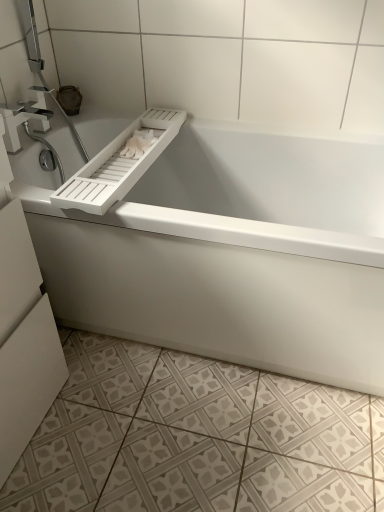
Question: Should I look upward or downward to see white matte toilet paper at upper center?

Choices:
 (A) down
 (B) up

Answer: (B)

Question: Is satin nickel faucet at upper left closer to camera compared to white matte bathtub at center?

Choices:
 (A) no
 (B) yes

Answer: (A)

Question: From a real-world perspective, is satin nickel faucet at upper left positioned under white matte bathtub at center based on gravity?

Choices:
 (A) yes
 (B) no

Answer: (B)

Question: Is satin nickel faucet at upper left with white matte bathtub at center?

Choices:
 (A) no
 (B) yes

Answer: (A)

Question: Is satin nickel faucet at upper left oriented away from white matte bathtub at center?

Choices:
 (A) yes
 (B) no

Answer: (B)

Question: Does satin nickel faucet at upper left have a larger size compared to white matte bathtub at center?

Choices:
 (A) yes
 (B) no

Answer: (B)

Question: From a real-world perspective, does satin nickel faucet at upper left stand above white matte bathtub at center?

Choices:
 (A) no
 (B) yes

Answer: (B)

Question: Considering the relative positions of white matte toilet paper at upper center and white textured tile at lower center in the image provided, is white matte toilet paper at upper center to the right of white textured tile at lower center from the viewer's perspective?

Choices:
 (A) yes
 (B) no

Answer: (B)

Question: Does white matte toilet paper at upper center have a lesser width compared to white textured tile at lower center?

Choices:
 (A) yes
 (B) no

Answer: (A)

Question: Considering the relative sizes of white matte toilet paper at upper center and white textured tile at lower center in the image provided, is white matte toilet paper at upper center bigger than white textured tile at lower center?

Choices:
 (A) no
 (B) yes

Answer: (A)

Question: From a real-world perspective, is white matte toilet paper at upper center positioned under white textured tile at lower center based on gravity?

Choices:
 (A) no
 (B) yes

Answer: (A)

Question: Does white matte toilet paper at upper center have a greater height compared to white textured tile at lower center?

Choices:
 (A) yes
 (B) no

Answer: (A)

Question: From the image's perspective, does white matte toilet paper at upper center appear higher than white textured tile at lower center?

Choices:
 (A) no
 (B) yes

Answer: (B)

Question: Can you confirm if white matte bathtub at center is wider than white textured tile at lower center?

Choices:
 (A) no
 (B) yes

Answer: (A)